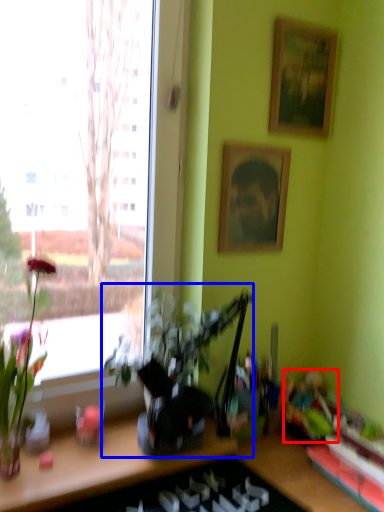
Question: Which of the following is the farthest to the observer, toy (highlighted by a red box) or houseplant (highlighted by a blue box)?

Choices:
 (A) toy
 (B) houseplant

Answer: (A)